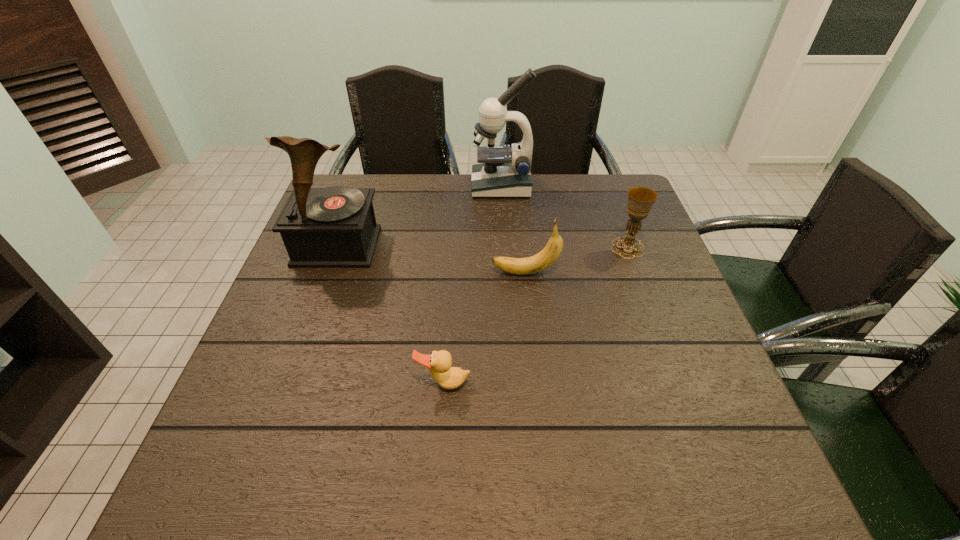
Locate an element on the screen. Image resolution: width=960 pixels, height=540 pixels. free space located 0.090m on the front of the chalice is located at coordinates (640, 283).

You are a GUI agent. You are given a task and a screenshot of the screen. Output one action in this format:
    pyautogui.click(x=<x>, y=<y>)
    Task: Click on the free space located 0.080m at the start of the peel on the banana
    This screenshot has width=960, height=540.
    Given the screenshot: What is the action you would take?
    pyautogui.click(x=460, y=273)

Locate an element on the screen. The height and width of the screenshot is (540, 960). free space located at the start of the peel on the banana is located at coordinates (365, 273).

Where is `vacant space located 0.090m at the start of the peel on the banana`? This screenshot has height=540, width=960. vacant space located 0.090m at the start of the peel on the banana is located at coordinates (456, 273).

This screenshot has height=540, width=960. I want to click on free space located on the beak of the nearest object, so click(x=442, y=416).

At what (x,y) coordinates should I click in order to perform the action: click on object located at the far edge. Please return your answer as a coordinate pair (x, y). Image resolution: width=960 pixels, height=540 pixels. Looking at the image, I should click on pos(505,172).

I want to click on object that is at the left edge, so click(x=334, y=227).

Where is `object present at the right edge`? The width and height of the screenshot is (960, 540). object present at the right edge is located at coordinates (640, 199).

Find the location of `free region at the far edge of the desktop`. free region at the far edge of the desktop is located at coordinates (554, 194).

Where is `free space at the near edge of the desktop`? This screenshot has width=960, height=540. free space at the near edge of the desktop is located at coordinates (642, 494).